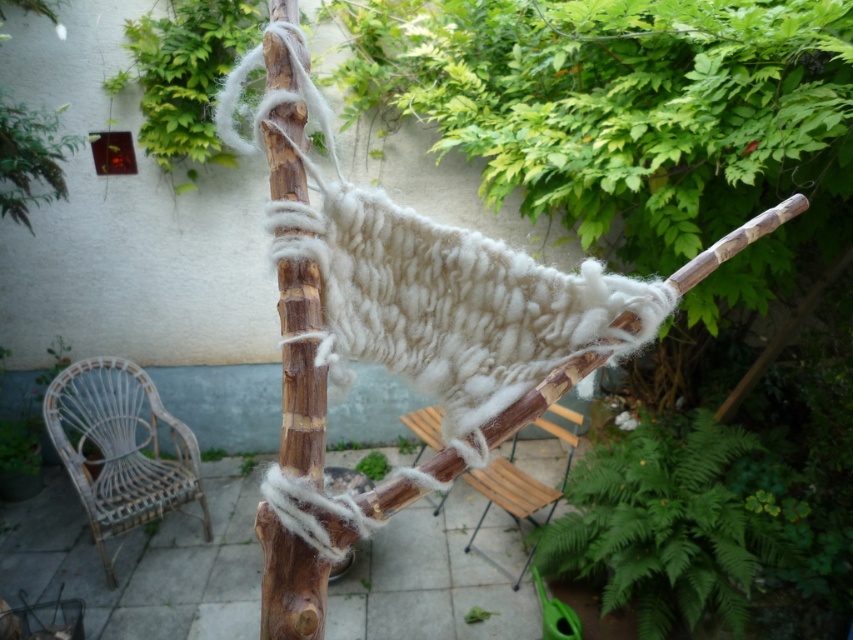
Between white wicker chair at lower left and wooden at center, which one appears on the right side from the viewer's perspective?

From the viewer's perspective, wooden at center appears more on the right side.

Which is behind, point (138, 449) or point (434, 442)?

Positioned behind is point (434, 442).

Locate an element on the screen. This screenshot has height=640, width=853. white wicker chair at lower left is located at coordinates (120, 449).

Between wooden stick at center and wooden at center, which one appears on the left side from the viewer's perspective?

Positioned to the left is wooden stick at center.

Describe the element at coordinates (289, 582) in the screenshot. This screenshot has height=640, width=853. I see `wooden stick at center` at that location.

You are a GUI agent. You are given a task and a screenshot of the screen. Output one action in this format:
    pyautogui.click(x=<x>, y=<y>)
    Task: Click on the wooden stick at center
    The height and width of the screenshot is (640, 853).
    Given the screenshot: What is the action you would take?
    pyautogui.click(x=289, y=582)

Is wooden stick at center bigger than white wicker chair at lower left?

No, wooden stick at center is not bigger than white wicker chair at lower left.

Is wooden stick at center positioned at the back of white wicker chair at lower left?

No, wooden stick at center is in front of white wicker chair at lower left.

Who is more forward, (x=282, y=400) or (x=82, y=433)?

Point (x=282, y=400) is more forward.

You are a GUI agent. You are given a task and a screenshot of the screen. Output one action in this format:
    pyautogui.click(x=<x>, y=<y>)
    Task: Click on the wooden stick at center
    The image size is (853, 640).
    Given the screenshot: What is the action you would take?
    pyautogui.click(x=289, y=582)